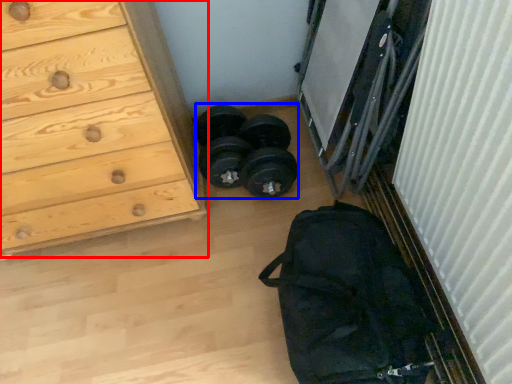
Question: Which object is closer to the camera taking this photo, chest of drawers (highlighted by a red box) or reel (highlighted by a blue box)?

Choices:
 (A) chest of drawers
 (B) reel

Answer: (A)